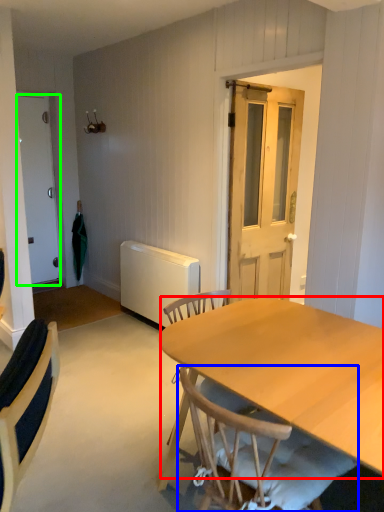
Question: Estimate the real-world distances between objects in this image. Which object is farther from tablecloth (highlighted by a red box), chair (highlighted by a blue box) or door (highlighted by a green box)?

Choices:
 (A) chair
 (B) door

Answer: (B)